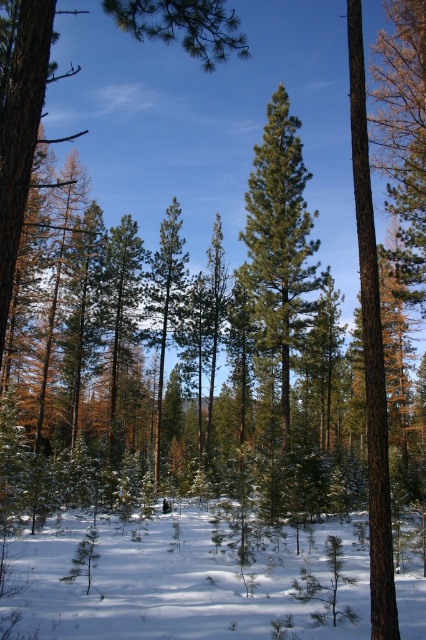
Does point (137, 625) come farther from viewer compared to point (264, 198)?

No, (137, 625) is in front of (264, 198).

Is white powdery snow at center behind green needle-like tree at center?

No, white powdery snow at center is in front of green needle-like tree at center.

Is point (16, 624) positioned after point (284, 381)?

No, it is not.

Image resolution: width=426 pixels, height=640 pixels. Identify the location of white powdery snow at center. (178, 580).